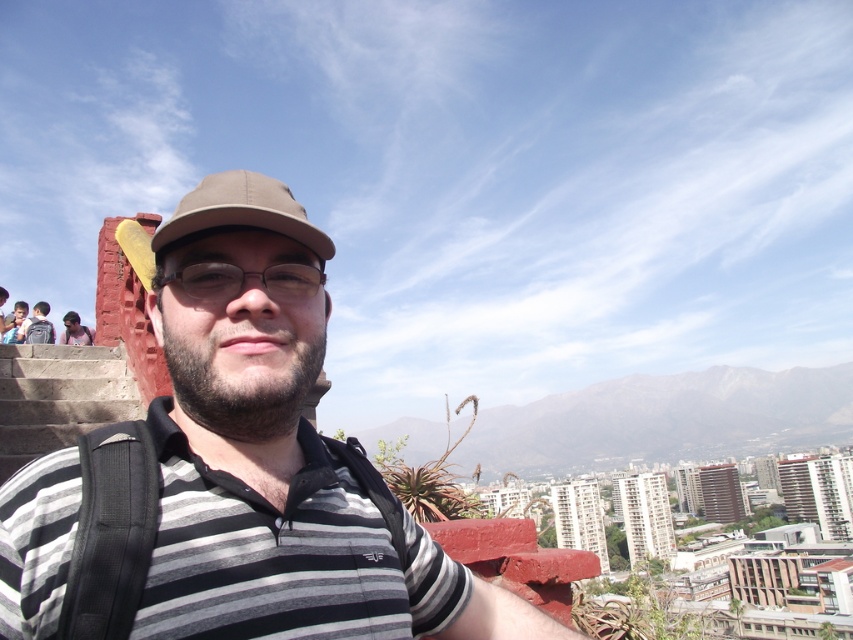
Is clear plastic glasses at center to the left of matte black backpack at left from the viewer's perspective?

No, clear plastic glasses at center is not to the left of matte black backpack at left.

Who is lower down, clear plastic glasses at center or matte black backpack at left?

Positioned lower is matte black backpack at left.

Between point (267, 294) and point (21, 300), which one is positioned in front?

Point (267, 294) is in front.

Identify the location of clear plastic glasses at center. (242, 282).

Does striped cotton shirt at center have a greater width compared to matte black backpack at lower left?

Yes.

Can you confirm if striped cotton shirt at center is bigger than matte black backpack at lower left?

Correct, striped cotton shirt at center is larger in size than matte black backpack at lower left.

Does point (309, 560) come behind point (67, 323)?

No, (309, 560) is closer to viewer.

Identify the location of striped cotton shirt at center. (282, 499).

Between striped cotton shirt at center and matte brown baseball cap at center, which one has more height?

Standing taller between the two is striped cotton shirt at center.

Describe the element at coordinates (282, 499) in the screenshot. I see `striped cotton shirt at center` at that location.

Is point (238, 332) closer to viewer compared to point (274, 216)?

Yes, it is in front of point (274, 216).

The image size is (853, 640). I want to click on striped cotton shirt at center, so click(282, 499).